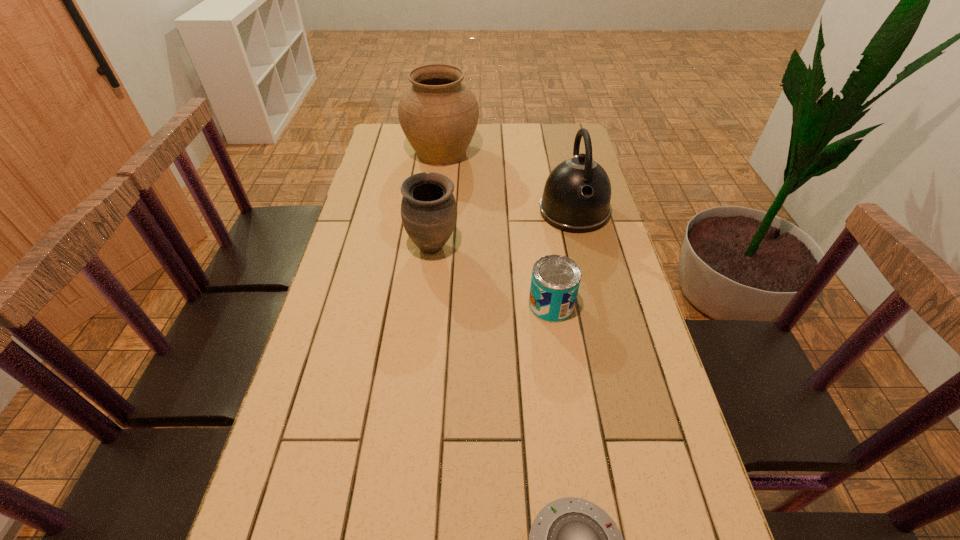
Find the location of `free space between the kettle and the nearer urn`. free space between the kettle and the nearer urn is located at coordinates (503, 229).

Find the location of a particular element. This screenshot has width=960, height=540. empty space that is in between the fourth tallest object and the nearer urn is located at coordinates (492, 276).

Find the location of a particular element. This screenshot has width=960, height=540. object that ranks as the second closest to the shorter urn is located at coordinates (576, 199).

Select which object appears as the second closest to the third shortest object. Please provide its 2D coordinates. Your answer should be formatted as a tuple, i.e. [(x, y)], where the tuple contains the x and y coordinates of a point satisfying the conditions above.

[(576, 199)]

Identify the location of vacant region that satisfies the following two spatial constraints: 1. on the front side of the can; 2. on the right side of the taller urn. (424, 305).